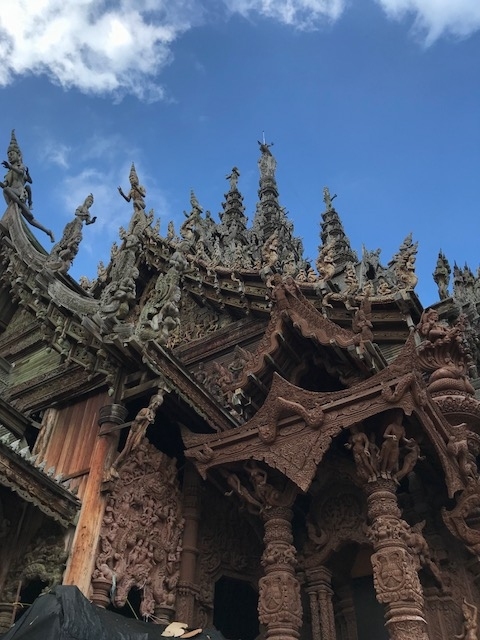
Find the location of a particular element. statue is located at coordinates (134, 204), (77, 226), (15, 180), (231, 192), (268, 210), (343, 244), (395, 268).